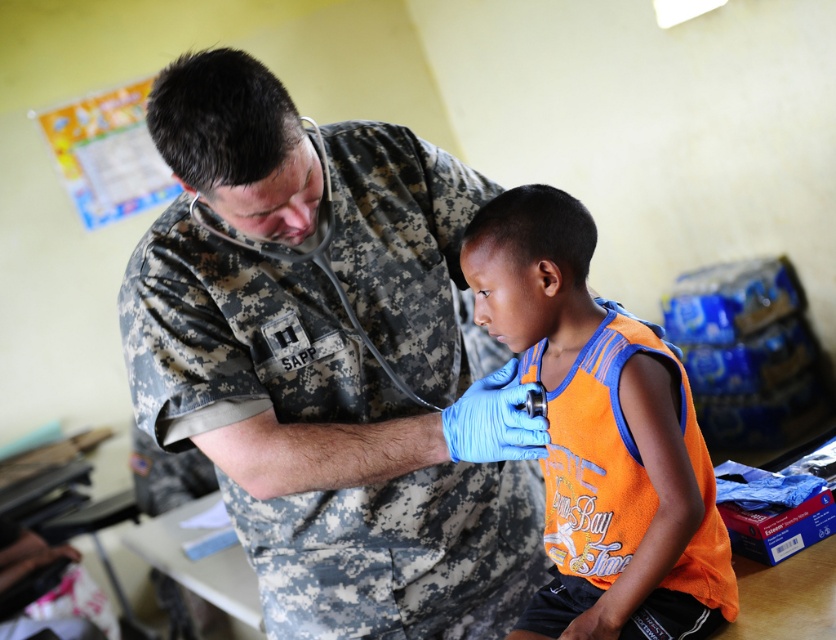
Question: Is camouflage uniform at center bigger than orange fabric shirt at center?

Choices:
 (A) yes
 (B) no

Answer: (A)

Question: Which of the following is the closest to the observer?

Choices:
 (A) (666, 577)
 (B) (441, 371)

Answer: (A)

Question: Which point is closer to the camera?

Choices:
 (A) (324, 476)
 (B) (472, 259)

Answer: (A)

Question: Is camouflage uniform at center to the left of orange fabric shirt at center from the viewer's perspective?

Choices:
 (A) no
 (B) yes

Answer: (B)

Question: Does camouflage uniform at center have a greater width compared to orange fabric shirt at center?

Choices:
 (A) no
 (B) yes

Answer: (B)